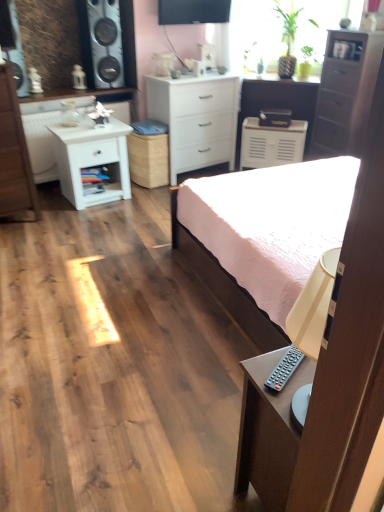
What are the coordinates of `vacant region in front of white matte nightstand at left` in the screenshot? It's located at (89, 215).